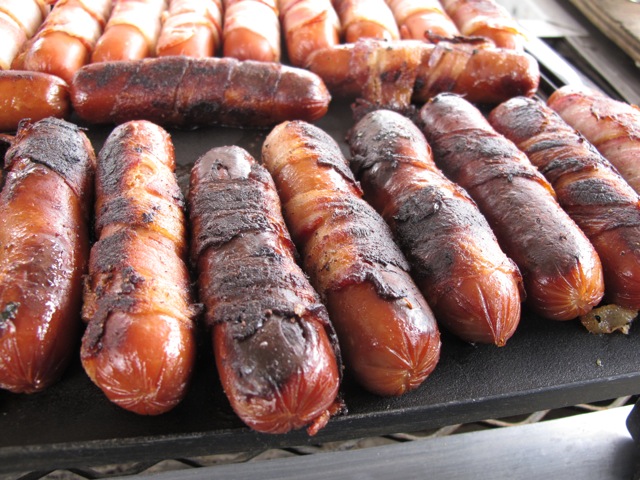
Where is `griddle`? griddle is located at coordinates (532, 368).